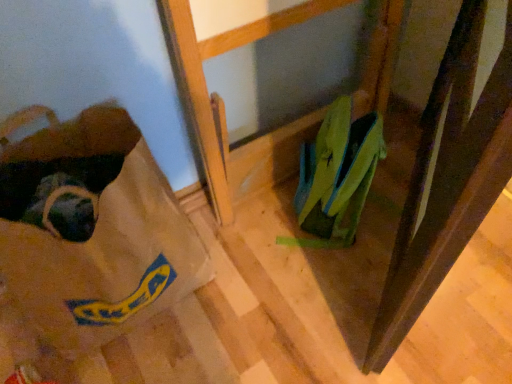
Question: From a real-world perspective, relative to green fabric shoe at lower right, is brown paper bag at lower left vertically above or below?

Choices:
 (A) below
 (B) above

Answer: (B)

Question: Considering the relative positions of brown paper bag at lower left and green fabric shoe at lower right in the image provided, is brown paper bag at lower left to the left or to the right of green fabric shoe at lower right?

Choices:
 (A) right
 (B) left

Answer: (B)

Question: Would you say brown paper bag at lower left is inside or outside green fabric shoe at lower right?

Choices:
 (A) inside
 (B) outside

Answer: (B)

Question: Is green fabric shoe at lower right bigger or smaller than brown paper bag at lower left?

Choices:
 (A) small
 (B) big

Answer: (A)

Question: Is green fabric shoe at lower right inside the boundaries of brown paper bag at lower left, or outside?

Choices:
 (A) outside
 (B) inside

Answer: (A)

Question: From a real-world perspective, is green fabric shoe at lower right above or below brown paper bag at lower left?

Choices:
 (A) below
 (B) above

Answer: (A)

Question: Considering the positions of green fabric shoe at lower right and brown paper bag at lower left in the image, is green fabric shoe at lower right wider or thinner than brown paper bag at lower left?

Choices:
 (A) wide
 (B) thin

Answer: (B)